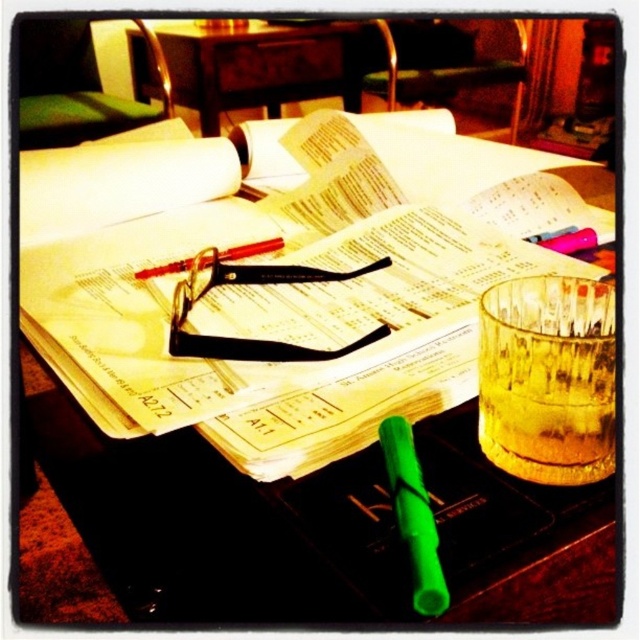
You are organizing a study session and need to place a new book on the desk. Considering the space between the translucent glass cup at center and the wooden table at center, will the book fit vertically without toppling over?

The translucent glass cup at center is shorter than the wooden table at center, so placing the book vertically between them should be stable as the cup won not interfere with the book height.

You are organizing the desk items. You need to move the green matte pencil at center to the front so it can be easily accessed. Is the pencil currently in front of or behind the black plastic glasses at center?

The green matte pencil at center is currently behind the black plastic glasses at center, so it is not in front. To access it easily, you would need to move it from behind the glasses to the front.